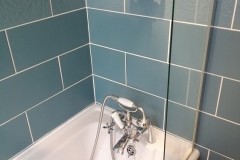
The width and height of the screenshot is (240, 160). Find the location of `bathtub`. bathtub is located at coordinates (77, 138).